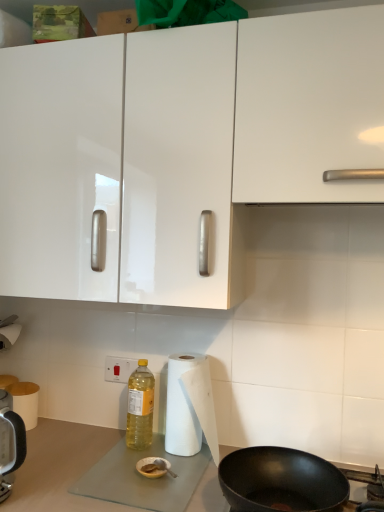
Find the location of a particular element. Image resolution: width=384 pixels, height=512 pixels. vacant area in front of white paper at lower center, the 2th paper towel viewed from the back is located at coordinates tap(170, 489).